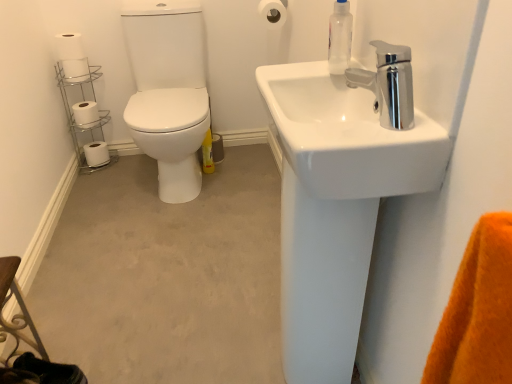
At what (x,y) coordinates should I click in order to perform the action: click on vacant space in front of chrome/metallic toilet paper holder at left. Please return your answer as a coordinate pair (x, y). This screenshot has width=512, height=384. Looking at the image, I should click on (97, 178).